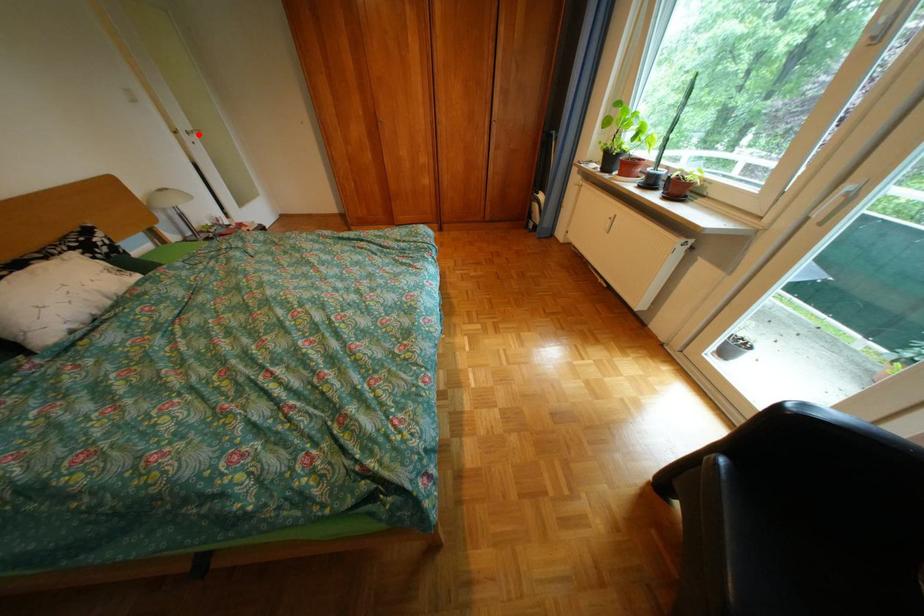
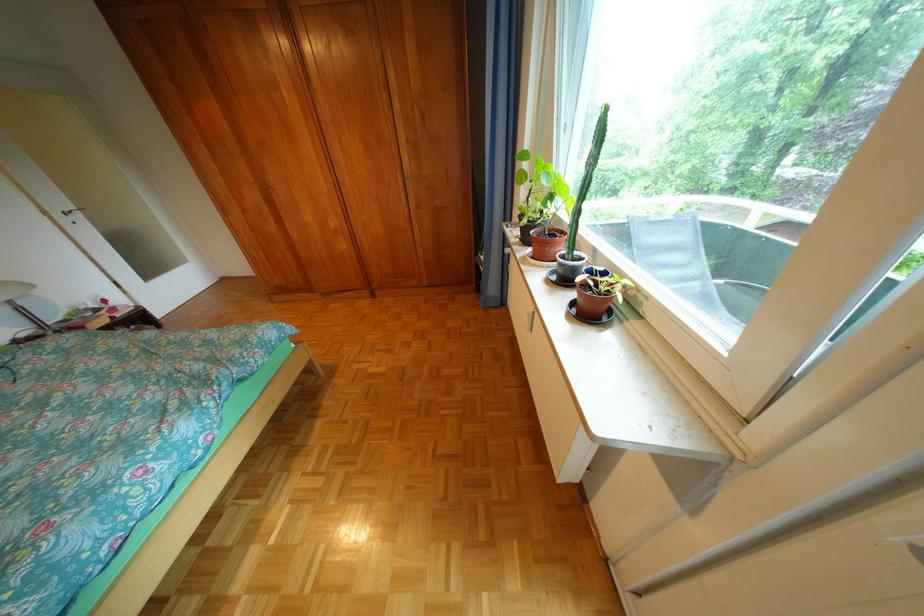
Where in the second image is the point corresponding to the highlighted location from the first image?

(73, 216)